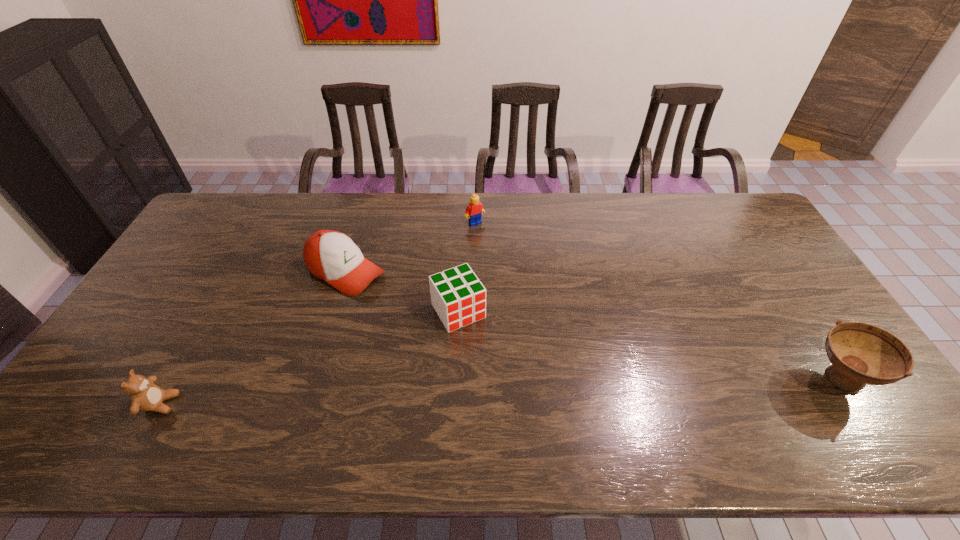
Image resolution: width=960 pixels, height=540 pixels. Identify the location of teddy bear. (145, 395).

You are a GUI agent. You are given a task and a screenshot of the screen. Output one action in this format:
    pyautogui.click(x=<x>, y=<y>)
    Task: Click on the rightmost object
    This screenshot has width=960, height=540.
    Given the screenshot: What is the action you would take?
    pyautogui.click(x=860, y=353)

I want to click on Lego, so click(x=475, y=208).

Identify the location of cube. tap(459, 298).

Find the location of a particular element. This screenshot has height=540, width=960. the second object from left to right is located at coordinates (332, 256).

At what (x,y) coordinates should I click in order to perform the action: click on free space located 0.290m on the front-facing side of the teddy bear. Please return your answer as a coordinate pair (x, y). This screenshot has width=960, height=540. Looking at the image, I should click on (295, 403).

The image size is (960, 540). Find the location of `vacant space positioned 0.180m on the left of the rightmost object`. vacant space positioned 0.180m on the left of the rightmost object is located at coordinates (735, 378).

What are the coordinates of `vacant space situated 0.130m on the face of the farthest object` in the screenshot? It's located at pyautogui.click(x=497, y=249).

The width and height of the screenshot is (960, 540). In order to click on vacant region located on the face of the farthest object in this screenshot , I will do `click(504, 258)`.

At what (x,y) coordinates should I click in order to perform the action: click on free location located 0.270m on the face of the farthest object. Please return your answer as a coordinate pair (x, y). The image size is (960, 540). Looking at the image, I should click on (517, 276).